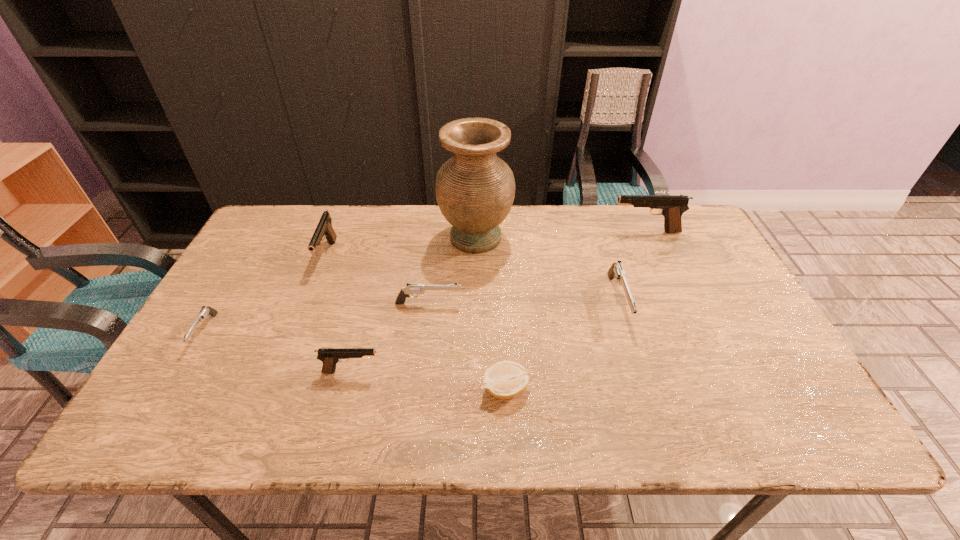
Find the location of a particular element. the second silver pistol from left to right is located at coordinates (412, 289).

Locate an element on the screen. The width and height of the screenshot is (960, 540). the second smallest silver pistol is located at coordinates (412, 289).

Find the location of `the leftmost pistol`. the leftmost pistol is located at coordinates (205, 311).

You are a GUI agent. You are given a task and a screenshot of the screen. Output one action in this format:
    pyautogui.click(x=<x>, y=<y>)
    Task: Click on the shortest pistol
    
    Given the screenshot: What is the action you would take?
    pyautogui.click(x=205, y=311)

Where is `lemon`? lemon is located at coordinates (505, 379).

The width and height of the screenshot is (960, 540). I want to click on vacant position located on the left of the green vase, so click(370, 238).

Find the location of a particular element. vacant space positioned 0.070m at the muzzle of the rightmost pistol is located at coordinates (589, 232).

Find the location of a particular element. vacant space situated 0.400m at the muzzle of the rightmost pistol is located at coordinates (487, 232).

I want to click on vacant space located at the muzzle of the rightmost pistol, so [x=518, y=232].

The image size is (960, 540). Identify the location of vacant space located at the muzzle of the second nearest black pistol. (300, 328).